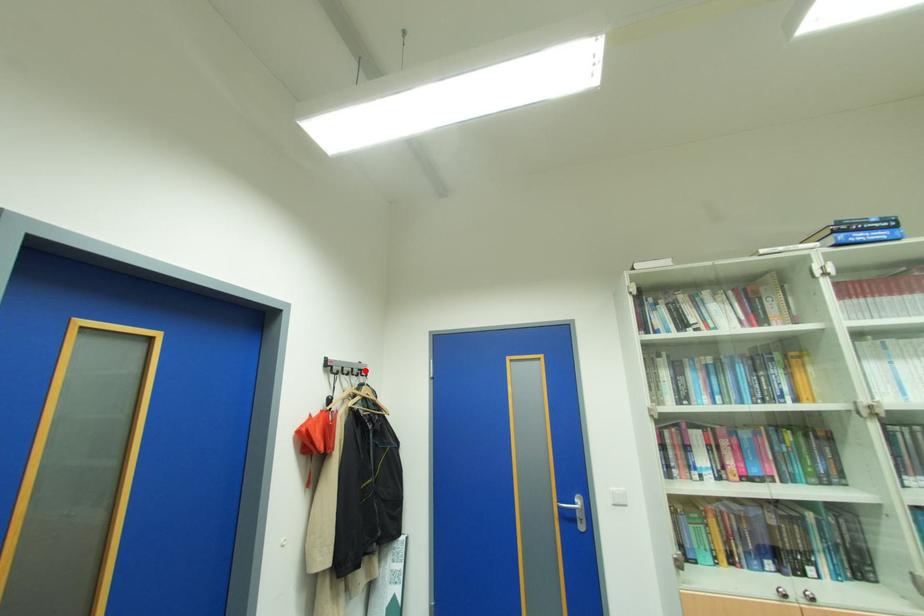
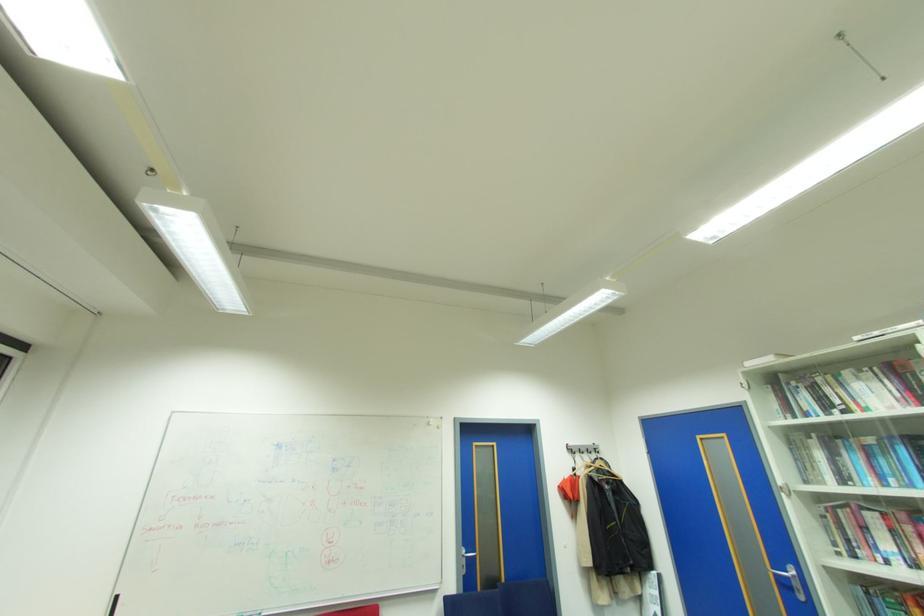
In the second image, find the point that corresponds to the highlighted location in the first image.

(600, 448)